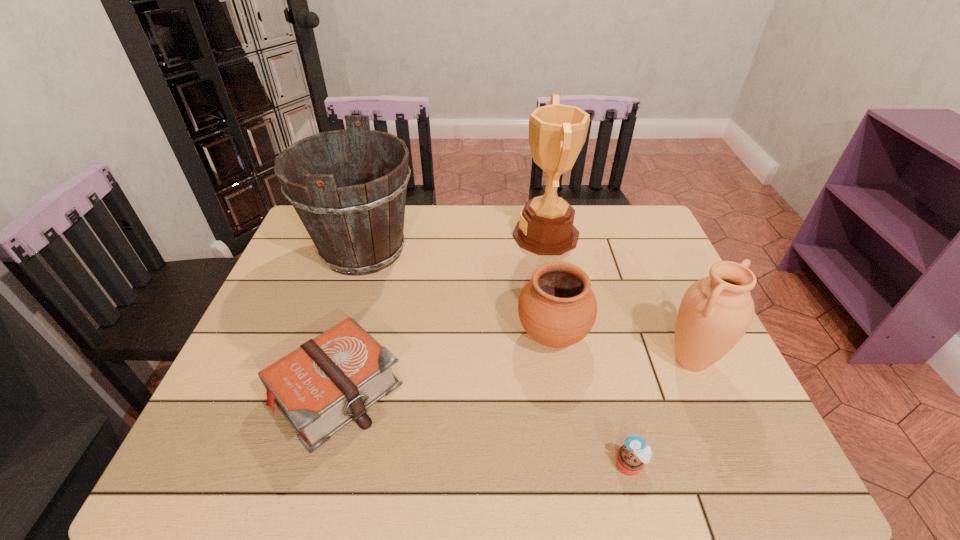
You are a GUI agent. You are given a task and a screenshot of the screen. Output one action in this format:
    pyautogui.click(x=<x>, y=<y>)
    Task: Click on the vacant position in the image that satisfies the following two spatial constraints: 1. on the front-facing side of the rightmost object; 2. on the right side of the award
    The height and width of the screenshot is (540, 960).
    Given the screenshot: What is the action you would take?
    pyautogui.click(x=569, y=361)